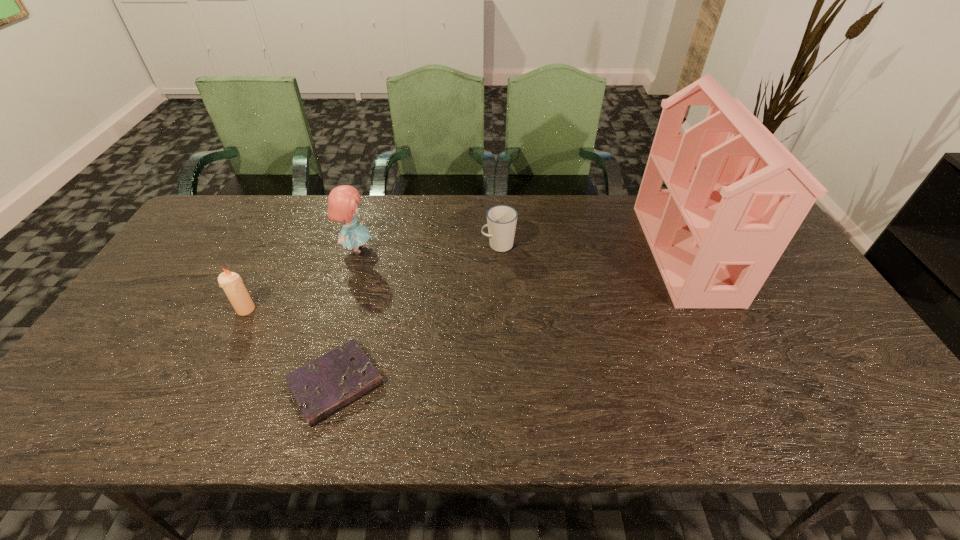
Find the location of a particular element. vacant space that satisfies the following two spatial constraints: 1. on the front-facing side of the diary; 2. on the right side of the fourth shortest object is located at coordinates 317,383.